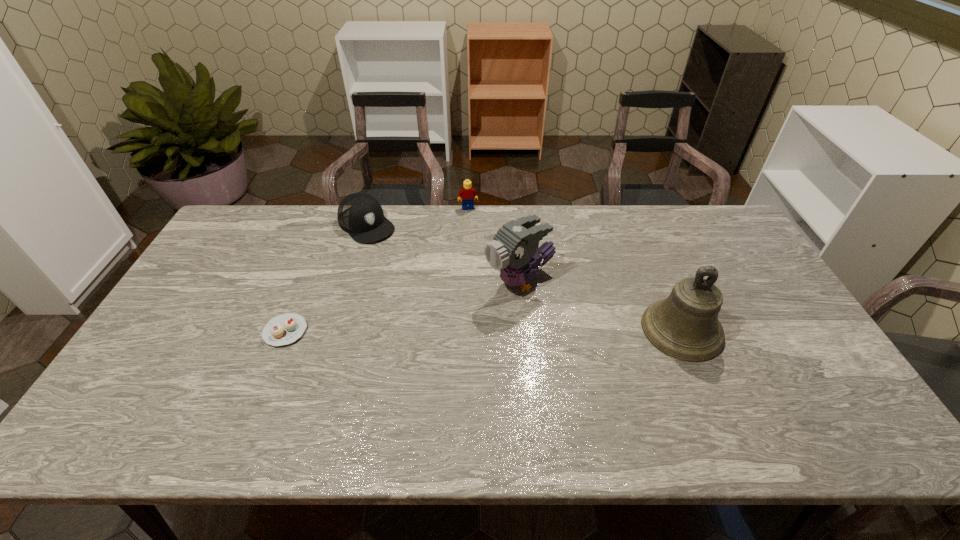
Locate an element on the screen. cupcake is located at coordinates (283, 329).

Locate an element on the screen. This screenshot has width=960, height=540. the rightmost object is located at coordinates (685, 326).

Where is `the third object from left to right`? Image resolution: width=960 pixels, height=540 pixels. the third object from left to right is located at coordinates (468, 194).

This screenshot has height=540, width=960. Identify the location of the second object from right to left. coord(514,251).

At what (x,y) coordinates should I click in order to perform the action: click on cap. Please return your answer as a coordinate pair (x, y). The width and height of the screenshot is (960, 540). Looking at the image, I should click on (361, 215).

The height and width of the screenshot is (540, 960). In order to click on free space located on the front of the cupcake in this screenshot , I will do `click(270, 371)`.

This screenshot has width=960, height=540. Find the location of `vacant space located on the left of the rightmost object`. vacant space located on the left of the rightmost object is located at coordinates (624, 329).

The width and height of the screenshot is (960, 540). Identify the location of vacant space situated on the front-facing side of the Lego. (472, 224).

Locate an element on the screen. free location located on the front-facing side of the Lego is located at coordinates (482, 269).

Where is `free space located 0.060m on the front-facing side of the Lego`? free space located 0.060m on the front-facing side of the Lego is located at coordinates (471, 220).